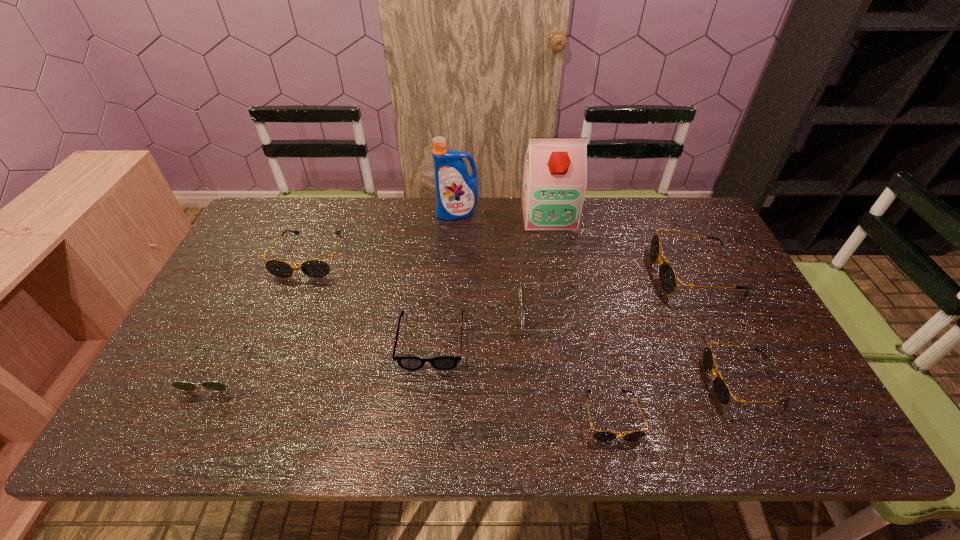
Where is `soya milk`? soya milk is located at coordinates (555, 169).

Where is `detergent`? This screenshot has width=960, height=540. detergent is located at coordinates (456, 191).

Where is `the seventh shortest object`? The height and width of the screenshot is (540, 960). the seventh shortest object is located at coordinates (668, 279).

Locate an element on the screen. The image size is (960, 540). the tallest sunglasses is located at coordinates (668, 279).

Where is `the second tallest sunglasses`? the second tallest sunglasses is located at coordinates (315, 268).

You are a GUI agent. You are given a task and a screenshot of the screen. Output one action in this format:
    pyautogui.click(x=<x>, y=<y>)
    Task: Click on the leftmost black sunglasses
    Image resolution: width=960 pixels, height=540 pixels.
    Given the screenshot: What is the action you would take?
    pyautogui.click(x=315, y=268)

Find the location of a particular element. The height and width of the screenshot is (540, 960). the bigger green sunglasses is located at coordinates (520, 294).

You are a GUI agent. You are given a task and a screenshot of the screen. Output one action in this format:
    pyautogui.click(x=<x>, y=<y>)
    Task: Click on the right green sunglasses
    This screenshot has height=540, width=960.
    Given the screenshot: What is the action you would take?
    pyautogui.click(x=520, y=294)

The width and height of the screenshot is (960, 540). In order to click on the third biggest black sunglasses in this screenshot , I will do coord(721,390).

I want to click on spectacles, so click(444, 363).